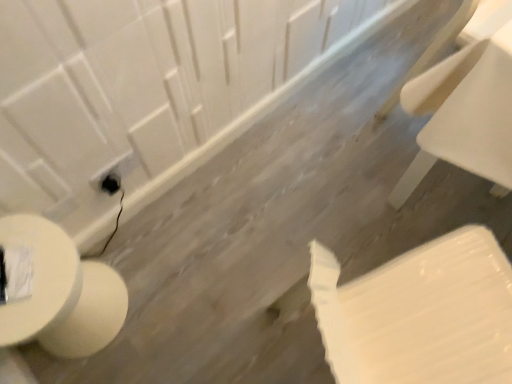
Question: Can you confirm if white glossy toilet paper at lower right is bigger than white glossy toilet at lower left?

Choices:
 (A) yes
 (B) no

Answer: (A)

Question: Is white glossy toilet paper at lower right taller than white glossy toilet at lower left?

Choices:
 (A) yes
 (B) no

Answer: (A)

Question: Could white glossy toilet at lower left be considered to be inside white glossy toilet paper at lower right?

Choices:
 (A) yes
 (B) no

Answer: (B)

Question: Does white glossy toilet paper at lower right appear on the right side of white glossy toilet at lower left?

Choices:
 (A) yes
 (B) no

Answer: (A)

Question: Is white glossy toilet paper at lower right positioned far away from white glossy toilet at lower left?

Choices:
 (A) no
 (B) yes

Answer: (A)

Question: Is white glossy toilet paper at lower right not within white glossy toilet at lower left?

Choices:
 (A) no
 (B) yes

Answer: (B)

Question: Can you confirm if black plastic electric outlet at lower left is taller than white glossy toilet paper at lower right?

Choices:
 (A) no
 (B) yes

Answer: (A)

Question: From the image's perspective, is black plastic electric outlet at lower left on white glossy toilet paper at lower right?

Choices:
 (A) no
 (B) yes

Answer: (B)

Question: Is black plastic electric outlet at lower left surrounding white glossy toilet paper at lower right?

Choices:
 (A) yes
 (B) no

Answer: (B)

Question: Considering the relative sizes of black plastic electric outlet at lower left and white glossy toilet paper at lower right in the image provided, is black plastic electric outlet at lower left thinner than white glossy toilet paper at lower right?

Choices:
 (A) no
 (B) yes

Answer: (B)

Question: Is black plastic electric outlet at lower left behind white glossy toilet paper at lower right?

Choices:
 (A) no
 (B) yes

Answer: (B)

Question: Can we say black plastic electric outlet at lower left lies outside white glossy toilet paper at lower right?

Choices:
 (A) yes
 (B) no

Answer: (A)

Question: Does white glossy toilet at lower left have a greater width compared to white plastic chair at upper right?

Choices:
 (A) yes
 (B) no

Answer: (B)